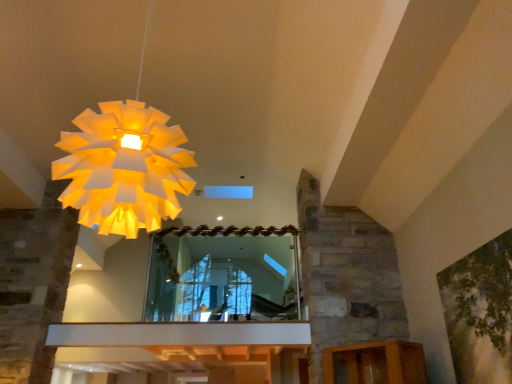
Question: Is green leafy tree at upper right shorter than white paper lampshade at upper left?

Choices:
 (A) yes
 (B) no

Answer: (A)

Question: Is green leafy tree at upper right located outside white paper lampshade at upper left?

Choices:
 (A) yes
 (B) no

Answer: (A)

Question: Is green leafy tree at upper right turned away from white paper lampshade at upper left?

Choices:
 (A) no
 (B) yes

Answer: (A)

Question: Can you confirm if green leafy tree at upper right is smaller than white paper lampshade at upper left?

Choices:
 (A) yes
 (B) no

Answer: (A)

Question: Is green leafy tree at upper right directly adjacent to white paper lampshade at upper left?

Choices:
 (A) no
 (B) yes

Answer: (A)

Question: From a real-world perspective, is green leafy tree at upper right physically below white paper lampshade at upper left?

Choices:
 (A) yes
 (B) no

Answer: (A)

Question: Can you confirm if white paper lampshade at upper left is taller than green leafy tree at upper right?

Choices:
 (A) no
 (B) yes

Answer: (B)

Question: Is white paper lampshade at upper left wider than green leafy tree at upper right?

Choices:
 (A) no
 (B) yes

Answer: (B)

Question: From the image's perspective, would you say white paper lampshade at upper left is positioned over green leafy tree at upper right?

Choices:
 (A) no
 (B) yes

Answer: (B)

Question: Is white paper lampshade at upper left not inside green leafy tree at upper right?

Choices:
 (A) no
 (B) yes

Answer: (B)

Question: Can you confirm if white paper lampshade at upper left is smaller than green leafy tree at upper right?

Choices:
 (A) no
 (B) yes

Answer: (A)

Question: Does white paper lampshade at upper left have a lesser height compared to green leafy tree at upper right?

Choices:
 (A) yes
 (B) no

Answer: (B)

Question: Is clear glass mirror at center at the back of white paper lampshade at upper left?

Choices:
 (A) no
 (B) yes

Answer: (A)